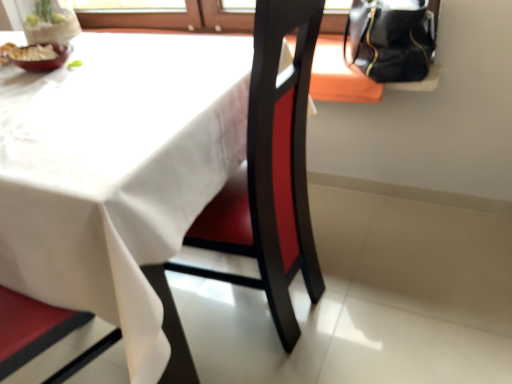
Image resolution: width=512 pixels, height=384 pixels. In order to click on vacant area that lies in front of matte ceramic bowl at upper left in this screenshot , I will do `click(32, 85)`.